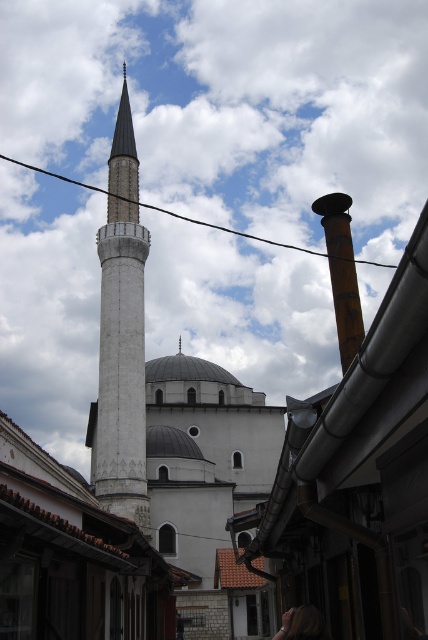
Is point (92, 449) less distant than point (216, 227)?

Yes, point (92, 449) is closer to viewer.

The height and width of the screenshot is (640, 428). I want to click on white stone minaret at left, so pos(121,336).

At what (x,y) coordinates should I click in order to perform the action: click on white stone minaret at left. Please return your answer as a coordinate pair (x, y). This screenshot has width=428, height=640. Looking at the image, I should click on 121,336.